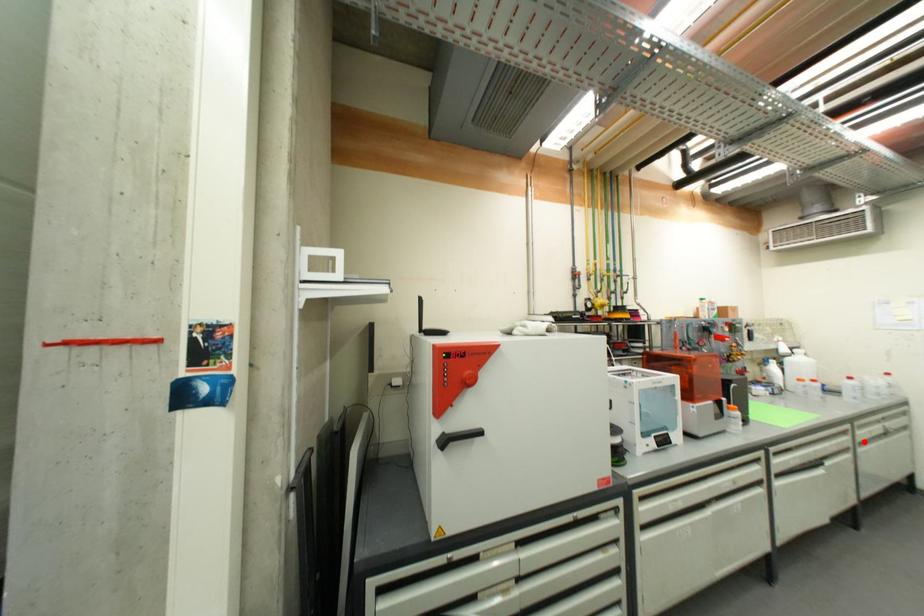
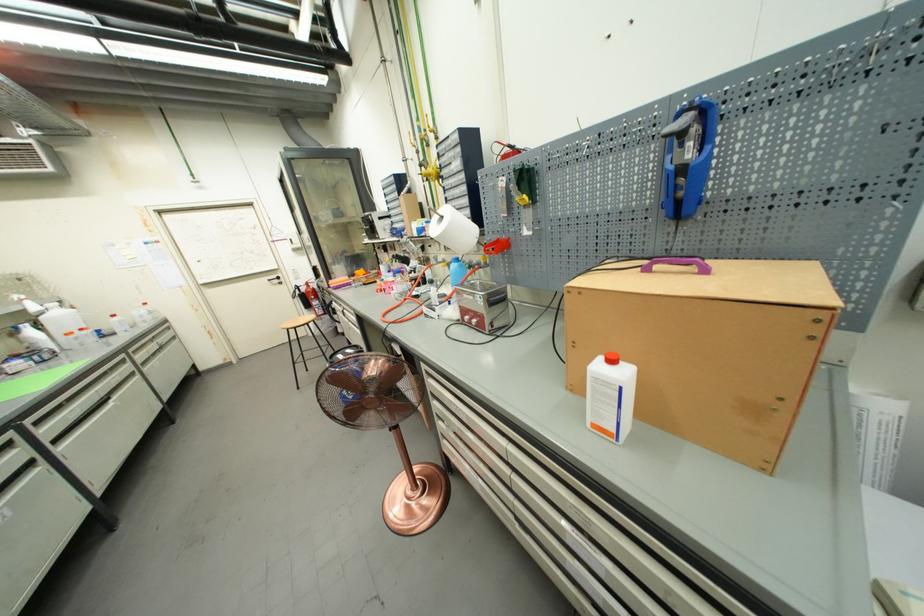
In the second image, find the point that corresponds to the highlighted location in the first image.

(146, 363)